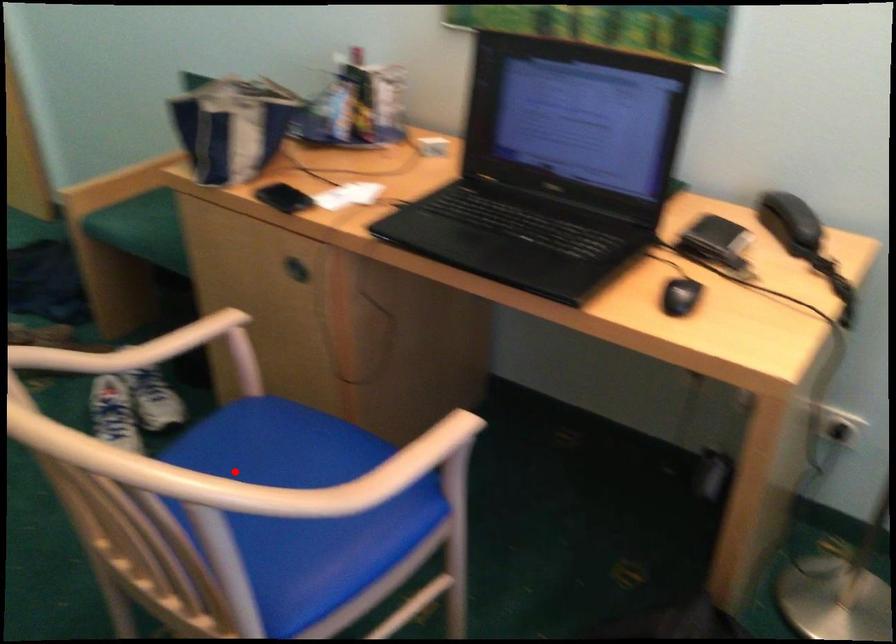
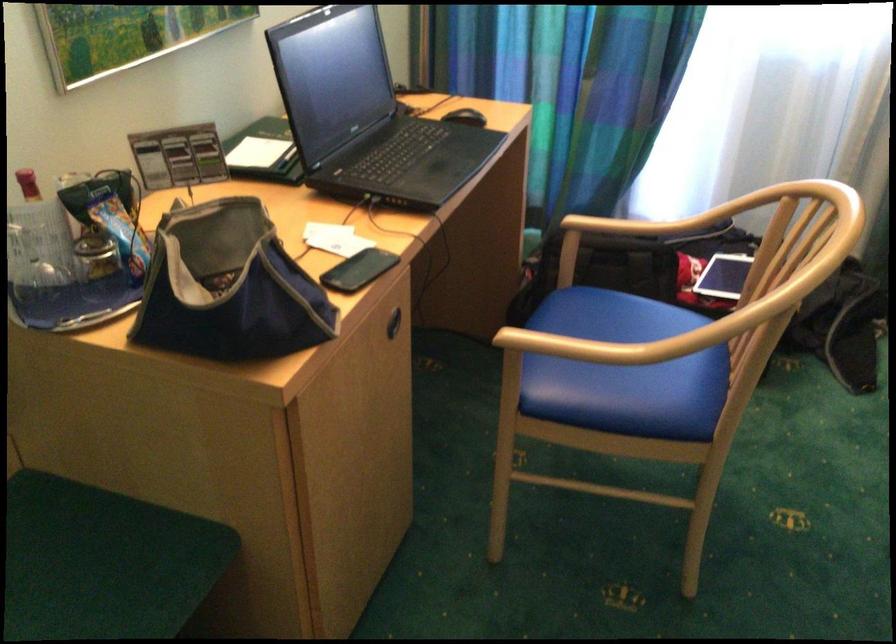
Question: A red point is marked in image1. In image2, is the corresponding 3D point closer to the camera or farther? Reply with the corresponding letter.

Choices:
 (A) The corresponding 3D point is closer.
 (B) The corresponding 3D point is farther.

Answer: (B)